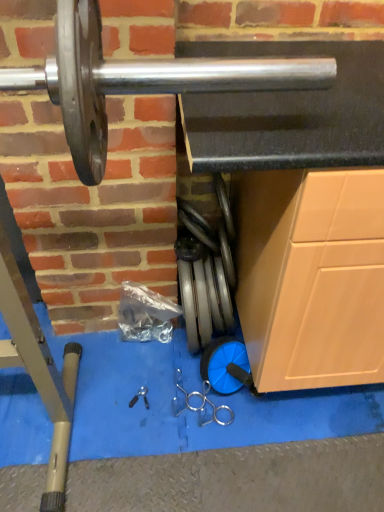
Measure the distance between point (131, 406) and camera.

A distance of 4.33 feet exists between point (131, 406) and camera.

At what (x,y) coordinates should I click in order to perform the action: click on black plastic tool at center, which is the first tool in left-to-right order. Please return your answer as a coordinate pair (x, y). This screenshot has height=512, width=384. Looking at the image, I should click on (139, 396).

Image resolution: width=384 pixels, height=512 pixels. What do you see at coordinates (139, 396) in the screenshot?
I see `black plastic tool at center, which appears as the 2th tool when viewed from the right` at bounding box center [139, 396].

Image resolution: width=384 pixels, height=512 pixels. What do you see at coordinates (205, 404) in the screenshot?
I see `silver metallic weight at center, which is the 1th tool from right to left` at bounding box center [205, 404].

The height and width of the screenshot is (512, 384). Find the location of `silver metallic weight at center, placed as the 2th tool when sorted from left to right`. silver metallic weight at center, placed as the 2th tool when sorted from left to right is located at coordinates (205, 404).

Identify the location of black plastic tool at center, which appears as the 2th tool when viewed from the right. The image size is (384, 512). pos(139,396).

Considering the positions of objects black plastic tool at center, which is the first tool in left-to-right order, and silver metallic weight at center, placed as the 2th tool when sorted from left to right, in the image provided, who is more to the left, black plastic tool at center, which is the first tool in left-to-right order, or silver metallic weight at center, placed as the 2th tool when sorted from left to right,?

black plastic tool at center, which is the first tool in left-to-right order, is more to the left.

In the image, is black plastic tool at center, which appears as the 2th tool when viewed from the right, positioned in front of or behind silver metallic weight at center, placed as the 2th tool when sorted from left to right?

In the image, black plastic tool at center, which appears as the 2th tool when viewed from the right, appears behind silver metallic weight at center, placed as the 2th tool when sorted from left to right.

Considering the points (146, 393) and (226, 407), which point is behind, point (146, 393) or point (226, 407)?

The point (146, 393) is behind.

From the image's perspective, relative to silver metallic weight at center, placed as the 2th tool when sorted from left to right, is black plastic tool at center, which is the first tool in left-to-right order, above or below?

black plastic tool at center, which is the first tool in left-to-right order, is situated lower than silver metallic weight at center, placed as the 2th tool when sorted from left to right, in the image.

From a real-world perspective, between black plastic tool at center, which is the first tool in left-to-right order, and silver metallic weight at center, which is the 1th tool from right to left, who is vertically higher?

In real-world perspective, silver metallic weight at center, which is the 1th tool from right to left, is above.

Which object is thinner, black plastic tool at center, which appears as the 2th tool when viewed from the right, or silver metallic weight at center, which is the 1th tool from right to left?

Thinner between the two is black plastic tool at center, which appears as the 2th tool when viewed from the right.

Between black plastic tool at center, which appears as the 2th tool when viewed from the right, and silver metallic weight at center, placed as the 2th tool when sorted from left to right, which one has more height?

With more height is silver metallic weight at center, placed as the 2th tool when sorted from left to right.

Consider the image. Considering the sizes of objects black plastic tool at center, which is the first tool in left-to-right order, and silver metallic weight at center, which is the 1th tool from right to left, in the image provided, who is bigger, black plastic tool at center, which is the first tool in left-to-right order, or silver metallic weight at center, which is the 1th tool from right to left,?

silver metallic weight at center, which is the 1th tool from right to left, is bigger.

Is silver metallic weight at center, placed as the 2th tool when sorted from left to right, completely or partially inside black plastic tool at center, which appears as the 2th tool when viewed from the right?

No, black plastic tool at center, which appears as the 2th tool when viewed from the right, does not contain silver metallic weight at center, placed as the 2th tool when sorted from left to right.

Is black plastic tool at center, which appears as the 2th tool when viewed from the right, placed right next to silver metallic weight at center, which is the 1th tool from right to left?

They are not placed beside each other.

Could you tell me if black plastic tool at center, which appears as the 2th tool when viewed from the right, is turned towards silver metallic weight at center, which is the 1th tool from right to left?

No, black plastic tool at center, which appears as the 2th tool when viewed from the right, is not aimed at silver metallic weight at center, which is the 1th tool from right to left.

The width and height of the screenshot is (384, 512). In the image, there is a black plastic tool at center, which is the first tool in left-to-right order. In order to click on tool above it (from the image's perspective) in this screenshot , I will do `click(205, 404)`.

Is silver metallic weight at center, placed as the 2th tool when sorted from left to right, at the left side of black plastic tool at center, which appears as the 2th tool when viewed from the right?

No, silver metallic weight at center, placed as the 2th tool when sorted from left to right, is not to the left of black plastic tool at center, which appears as the 2th tool when viewed from the right.

Which object is more forward, silver metallic weight at center, which is the 1th tool from right to left, or black plastic tool at center, which appears as the 2th tool when viewed from the right?

silver metallic weight at center, which is the 1th tool from right to left, is closer to the camera.

Is point (193, 391) positioned before point (144, 400)?

No, it is behind (144, 400).

From the image's perspective, which is below, silver metallic weight at center, placed as the 2th tool when sorted from left to right, or black plastic tool at center, which is the first tool in left-to-right order?

black plastic tool at center, which is the first tool in left-to-right order.

From a real-world perspective, which is physically above, silver metallic weight at center, which is the 1th tool from right to left, or black plastic tool at center, which is the first tool in left-to-right order?

In real-world perspective, silver metallic weight at center, which is the 1th tool from right to left, is above.

Considering the relative sizes of silver metallic weight at center, placed as the 2th tool when sorted from left to right, and black plastic tool at center, which is the first tool in left-to-right order, in the image provided, is silver metallic weight at center, placed as the 2th tool when sorted from left to right, thinner than black plastic tool at center, which is the first tool in left-to-right order,?

No, silver metallic weight at center, placed as the 2th tool when sorted from left to right, is not thinner than black plastic tool at center, which is the first tool in left-to-right order.

Who is taller, silver metallic weight at center, which is the 1th tool from right to left, or black plastic tool at center, which is the first tool in left-to-right order?

With more height is silver metallic weight at center, which is the 1th tool from right to left.

Considering the relative sizes of silver metallic weight at center, which is the 1th tool from right to left, and black plastic tool at center, which is the first tool in left-to-right order, in the image provided, is silver metallic weight at center, which is the 1th tool from right to left, smaller than black plastic tool at center, which is the first tool in left-to-right order,?

Actually, silver metallic weight at center, which is the 1th tool from right to left, might be larger than black plastic tool at center, which is the first tool in left-to-right order.

In the scene shown: Would you say silver metallic weight at center, placed as the 2th tool when sorted from left to right, contains black plastic tool at center, which is the first tool in left-to-right order?

No, black plastic tool at center, which is the first tool in left-to-right order, is not surrounded by silver metallic weight at center, placed as the 2th tool when sorted from left to right.

Is silver metallic weight at center, placed as the 2th tool when sorted from left to right, oriented away from black plastic tool at center, which is the first tool in left-to-right order?

No, black plastic tool at center, which is the first tool in left-to-right order, is not at the back of silver metallic weight at center, placed as the 2th tool when sorted from left to right.

What's the angular difference between silver metallic weight at center, placed as the 2th tool when sorted from left to right, and black plastic tool at center, which is the first tool in left-to-right order,'s facing directions?

The facing directions of silver metallic weight at center, placed as the 2th tool when sorted from left to right, and black plastic tool at center, which is the first tool in left-to-right order, are 1.67 degrees apart.

Where is `tool above the black plastic tool at center, which is the first tool in left-to-right order (from a real-world perspective)`? The image size is (384, 512). tool above the black plastic tool at center, which is the first tool in left-to-right order (from a real-world perspective) is located at coordinates (205, 404).

This screenshot has height=512, width=384. I want to click on tool lying behind the silver metallic weight at center, placed as the 2th tool when sorted from left to right, so click(x=139, y=396).

Find the location of a particular element. This screenshot has height=512, width=384. tool located on the left of silver metallic weight at center, placed as the 2th tool when sorted from left to right is located at coordinates (139, 396).